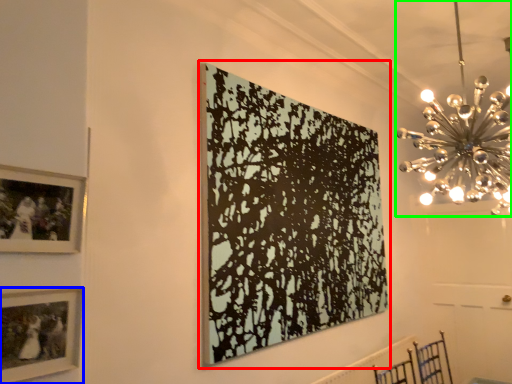
Question: Considering the real-world distances, which object is farthest from picture frame (highlighted by a red box)? picture frame (highlighted by a blue box) or chandelier (highlighted by a green box)?

Choices:
 (A) picture frame
 (B) chandelier

Answer: (A)